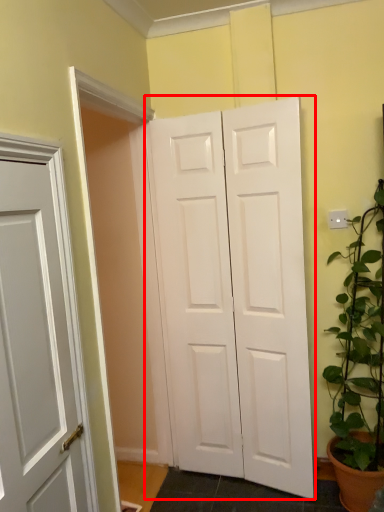
Question: From the image's perspective, considering the relative positions of door (annotated by the red box) and houseplant in the image provided, where is door (annotated by the red box) located with respect to the staircase?

Choices:
 (A) above
 (B) below

Answer: (A)